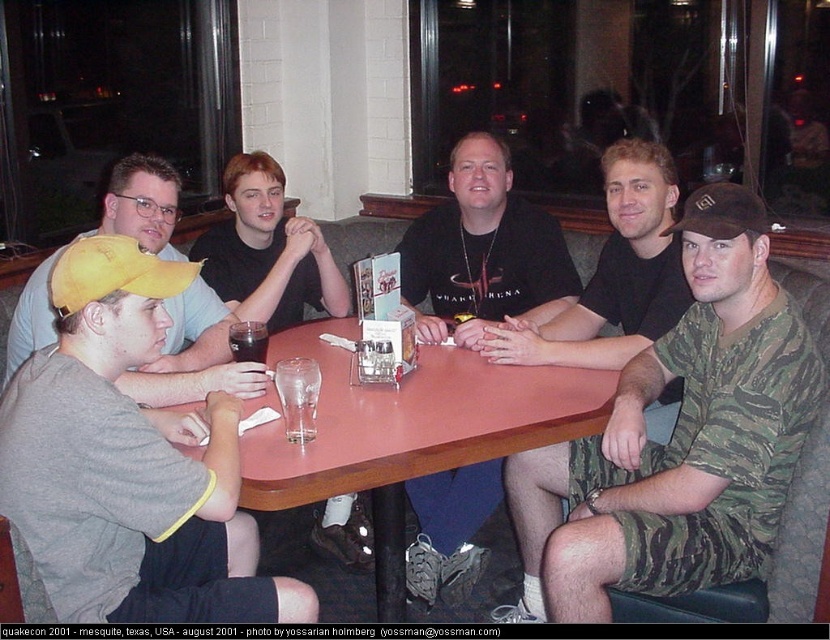
Between pink laminate table at center and yellow fabric baseball cap at left, which one has more height?

pink laminate table at center is taller.

Between pink laminate table at center and yellow fabric baseball cap at left, which one appears on the right side from the viewer's perspective?

pink laminate table at center

The image size is (830, 640). Describe the element at coordinates (409, 433) in the screenshot. I see `pink laminate table at center` at that location.

The height and width of the screenshot is (640, 830). In order to click on pink laminate table at center in this screenshot , I will do `click(409, 433)`.

Does black matte shirt at center appear under black shirt at center?

Yes.

Where is `black matte shirt at center`? This screenshot has width=830, height=640. black matte shirt at center is located at coordinates (482, 252).

This screenshot has width=830, height=640. Find the location of `black matte shirt at center`. black matte shirt at center is located at coordinates (482, 252).

Is point (194, 561) farther from viewer compared to point (157, 296)?

Yes, point (194, 561) is farther from viewer.

Between gray cotton t-shirt at left and yellow fabric baseball cap at left, which one appears on the right side from the viewer's perspective?

gray cotton t-shirt at left

Find the location of a particular element. This screenshot has width=830, height=640. gray cotton t-shirt at left is located at coordinates (128, 461).